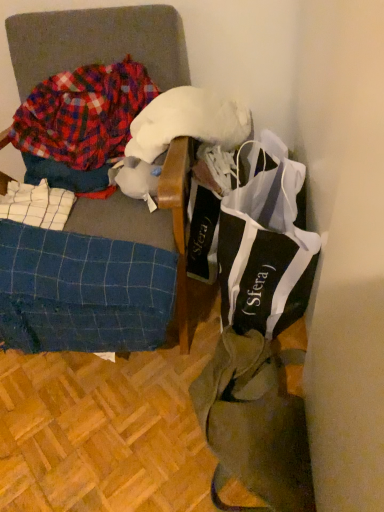
Question: From their relative heights in the image, would you say plaid flannel shirt at left is taller or shorter than blue plaid fabric at left?

Choices:
 (A) short
 (B) tall

Answer: (A)

Question: Looking at the image, does plaid flannel shirt at left seem bigger or smaller compared to blue plaid fabric at left?

Choices:
 (A) big
 (B) small

Answer: (B)

Question: Estimate the real-world distances between objects in this image. Which object is closer to the white fluffy wool at upper center?

Choices:
 (A) black and white fabric bag at right
 (B) blue plaid fabric at left
 (C) plaid flannel shirt at left
 (D) blue checkered fabric at lower left
 (E) olive green canvas tote bag at lower right

Answer: (C)

Question: Based on their relative distances, which object is farther from the plaid flannel shirt at left?

Choices:
 (A) olive green canvas tote bag at lower right
 (B) black and white fabric bag at right
 (C) blue plaid fabric at left
 (D) white fluffy wool at upper center
 (E) blue checkered fabric at lower left

Answer: (A)